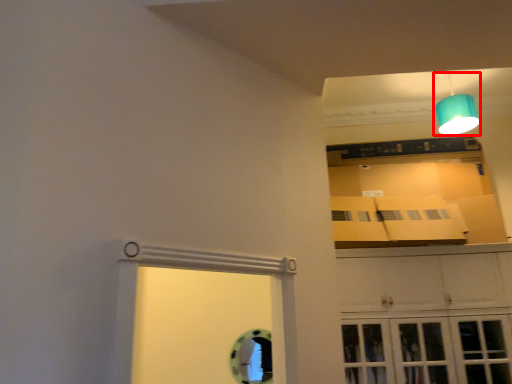
Question: Observing the image, what is the correct spatial positioning of lamp (annotated by the red box) in reference to cabinetry?

Choices:
 (A) right
 (B) left

Answer: (A)